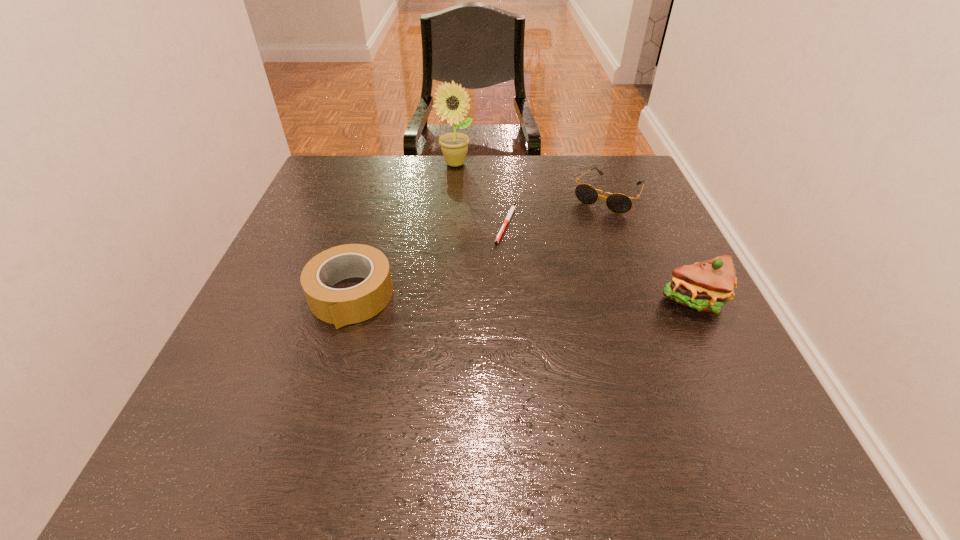
At what (x,y) coordinates should I click in order to perform the action: click on the leftmost object. Please return your answer as a coordinate pair (x, y). The width and height of the screenshot is (960, 540). Looking at the image, I should click on (341, 307).

Where is `sandwich`? Image resolution: width=960 pixels, height=540 pixels. sandwich is located at coordinates (704, 286).

Find the location of `sunglasses`. sunglasses is located at coordinates (618, 203).

Where is `sunflower`? This screenshot has width=960, height=540. sunflower is located at coordinates [454, 146].

Image resolution: width=960 pixels, height=540 pixels. In order to click on the tallest object in this screenshot , I will do `click(454, 146)`.

What are the coordinates of `the shortest object` in the screenshot? It's located at (512, 208).

Locate an element on the screen. pen is located at coordinates (512, 208).

Locate an element on the screen. The height and width of the screenshot is (540, 960). free space located 0.080m at the edge of the leftmost object is located at coordinates (330, 366).

Find the location of a particular element. The height and width of the screenshot is (540, 960). vacant space situated 0.230m on the left of the fourth shortest object is located at coordinates (544, 300).

I want to click on vacant region located on the front-facing side of the sunglasses, so click(527, 316).